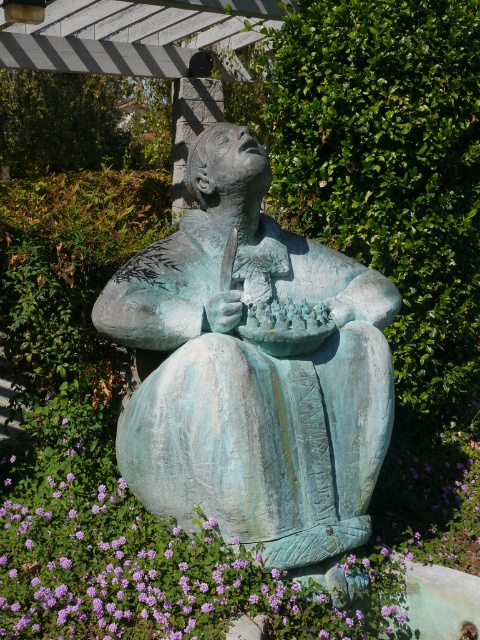
Question: Is green patina statue at center bigger than purple matte flower at lower left?

Choices:
 (A) yes
 (B) no

Answer: (B)

Question: Which of the following is the closest to the observer?

Choices:
 (A) (216, 364)
 (B) (257, 595)

Answer: (B)

Question: Is green patina statue at center to the left of purple matte flower at lower left from the viewer's perspective?

Choices:
 (A) yes
 (B) no

Answer: (B)

Question: Does green patina statue at center appear under purple matte flower at lower left?

Choices:
 (A) no
 (B) yes

Answer: (A)